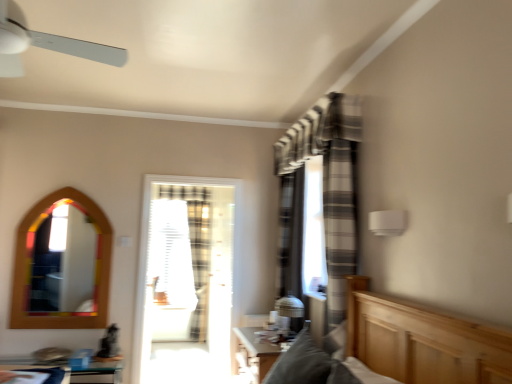
Question: Does gray striped curtain at center turn towards clear plastic screen at center?

Choices:
 (A) no
 (B) yes

Answer: (A)

Question: Is gray striped curtain at center taller than clear plastic screen at center?

Choices:
 (A) yes
 (B) no

Answer: (B)

Question: Is gray striped curtain at center positioned before clear plastic screen at center?

Choices:
 (A) no
 (B) yes

Answer: (B)

Question: Considering the relative sizes of gray striped curtain at center and clear plastic screen at center in the image provided, is gray striped curtain at center wider than clear plastic screen at center?

Choices:
 (A) yes
 (B) no

Answer: (A)

Question: Is gray striped curtain at center turned away from clear plastic screen at center?

Choices:
 (A) yes
 (B) no

Answer: (B)

Question: Considering the positions of point pyautogui.click(x=57, y=223) and point pyautogui.click(x=16, y=23), is point pyautogui.click(x=57, y=223) closer or farther from the camera than point pyautogui.click(x=16, y=23)?

Choices:
 (A) closer
 (B) farther

Answer: (B)

Question: From a real-world perspective, is wooden mirror at left above or below white plastic ceiling fan at upper left?

Choices:
 (A) above
 (B) below

Answer: (B)

Question: In terms of height, does wooden mirror at left look taller or shorter compared to white plastic ceiling fan at upper left?

Choices:
 (A) tall
 (B) short

Answer: (A)

Question: In the image, is wooden mirror at left positioned in front of or behind white plastic ceiling fan at upper left?

Choices:
 (A) front
 (B) behind

Answer: (B)

Question: Looking at their shapes, would you say gray striped curtain at center is wider or thinner than translucent glass door at center?

Choices:
 (A) thin
 (B) wide

Answer: (B)

Question: Is gray striped curtain at center to the left or to the right of translucent glass door at center in the image?

Choices:
 (A) right
 (B) left

Answer: (A)

Question: From the image's perspective, is gray striped curtain at center positioned above or below translucent glass door at center?

Choices:
 (A) below
 (B) above

Answer: (B)

Question: Relative to translucent glass door at center, is gray striped curtain at center in front or behind?

Choices:
 (A) front
 (B) behind

Answer: (A)

Question: From a real-world perspective, is white plastic ceiling fan at upper left above or below clear plastic screen at center?

Choices:
 (A) below
 (B) above

Answer: (B)

Question: In terms of size, does white plastic ceiling fan at upper left appear bigger or smaller than clear plastic screen at center?

Choices:
 (A) big
 (B) small

Answer: (A)